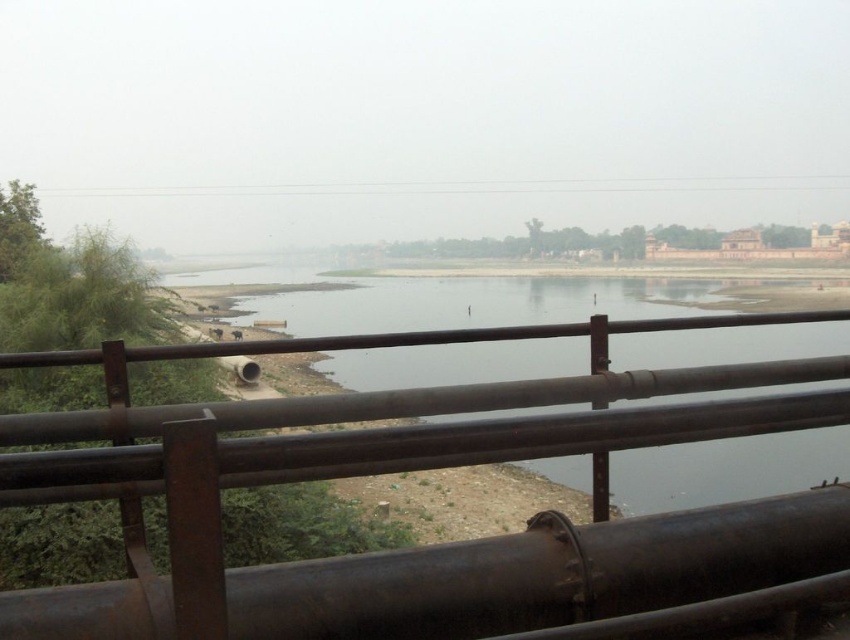
Based on the photo, you are standing on the bridge and want to take a photo of the cows grazing near the riverbank. If your camera has a focal length of 50mm, will the rusty metal rail at center obstruct your shot? Assume the camera is positioned at the same level as the rail.

The rusty metal rail at center is 1.74 meters away from the camera. Since the camera is positioned at the same level as the rail, you will need to move back or adjust your angle to avoid the obstruction caused by the rusty metal rail at center.

You are standing on the bridge looking down at the river. There are two points marked on the railing. Which point is closer to you, point 1 at coordinates point [51,429] or point 2 at coordinates point [785,292]?

Point [51,429] is closer to the viewer than point [785,292].